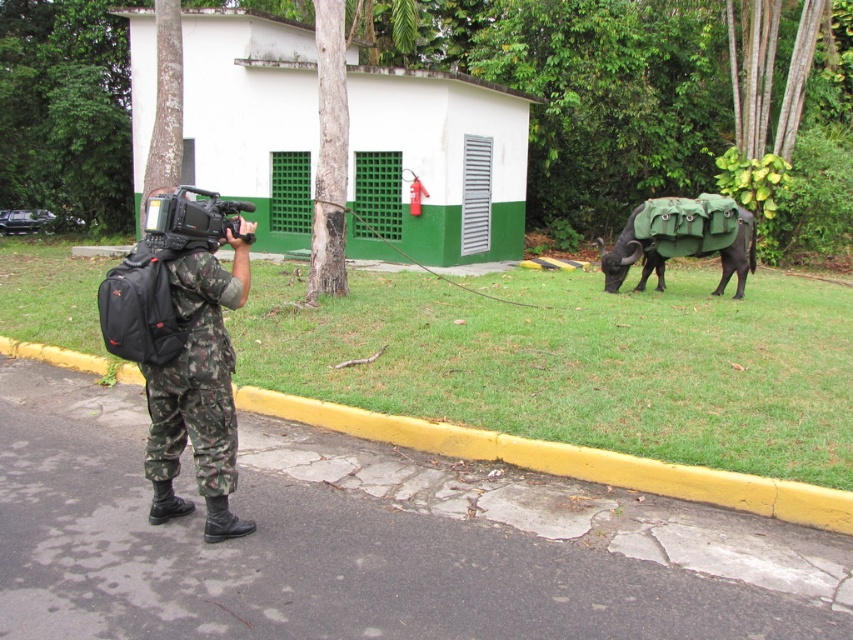
Question: Considering the relative positions of green fabric-covered animal at right and black matte video camera at left in the image provided, where is green fabric-covered animal at right located with respect to black matte video camera at left?

Choices:
 (A) left
 (B) right

Answer: (B)

Question: Which object appears farthest from the camera in this image?

Choices:
 (A) green fabric-covered animal at right
 (B) black matte video camera at left
 (C) camouflage fabric uniform at left

Answer: (A)

Question: Which of the following is the farthest from the observer?

Choices:
 (A) (160, 204)
 (B) (743, 225)
 (C) (213, 301)

Answer: (B)

Question: Among these objects, which one is nearest to the camera?

Choices:
 (A) black matte video camera at left
 (B) green fabric-covered animal at right
 (C) camouflage fabric uniform at left

Answer: (C)

Question: Is camouflage fabric uniform at left closer to camera compared to green fabric-covered animal at right?

Choices:
 (A) yes
 (B) no

Answer: (A)

Question: Is camouflage fabric uniform at left above green fabric-covered animal at right?

Choices:
 (A) no
 (B) yes

Answer: (A)